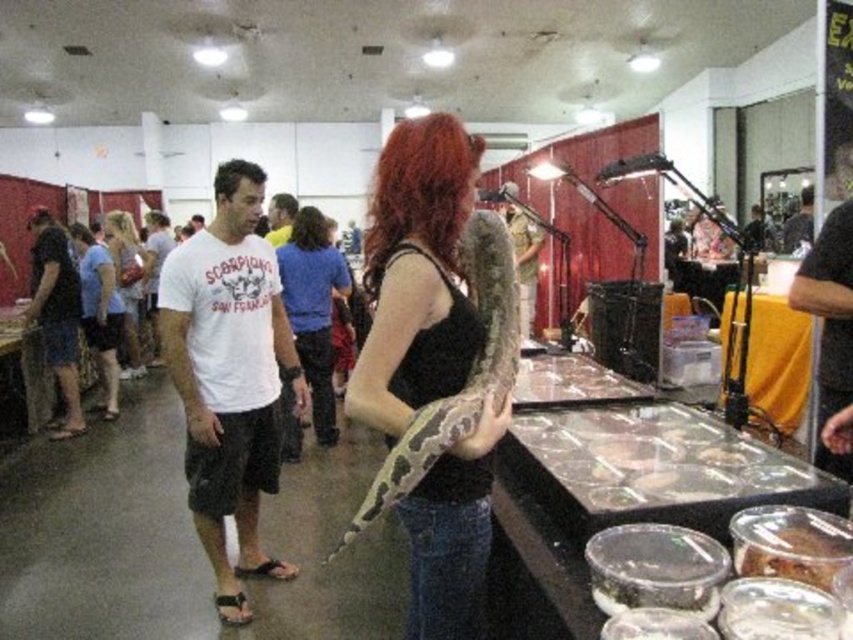
You are a photographer positioned at the front of the scene. You need to capture a photo that includes both the matte black tank top at center and the matte black shirt at center. What is the minimum distance you need to move backward to ensure both items are in frame?

The minimum distance you need to move backward is 6.39 meters to ensure both the matte black tank top at center and the matte black shirt at center are in frame.